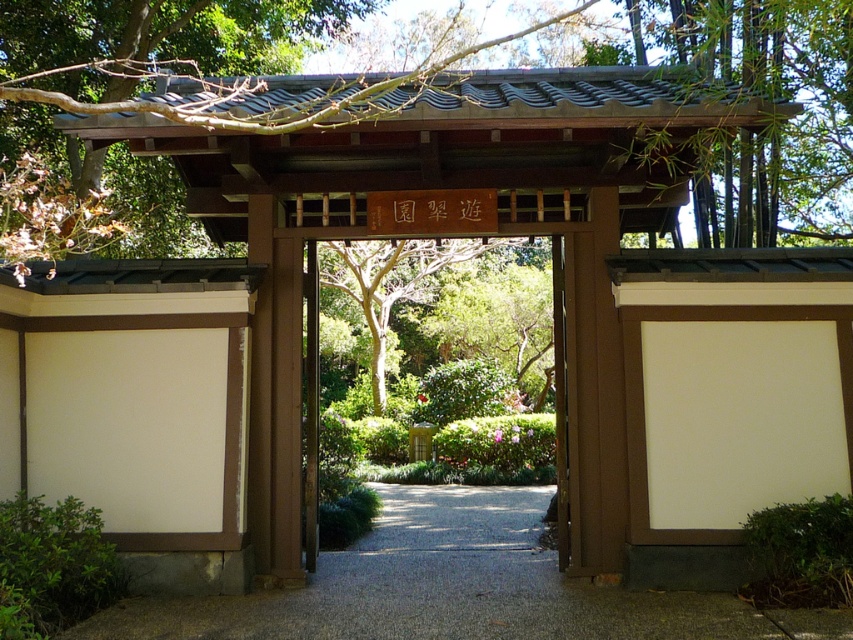
You are standing at the entrance of the torii gate and want to walk towards the garden. Which direction should you go to follow the smooth gravel path at center?

The smooth gravel path at center is located at point (454, 588), so you should walk forward towards the center to follow it.

You are a visitor approaching the brown wooden gate at upper center. You want to walk along the smooth gravel path at center. Which direction should you go after passing through the gate?

The smooth gravel path at center is bigger than the brown wooden gate at upper center, so after passing through the gate, you should go straight ahead along the smooth gravel path at center since it is wider and more prominent.